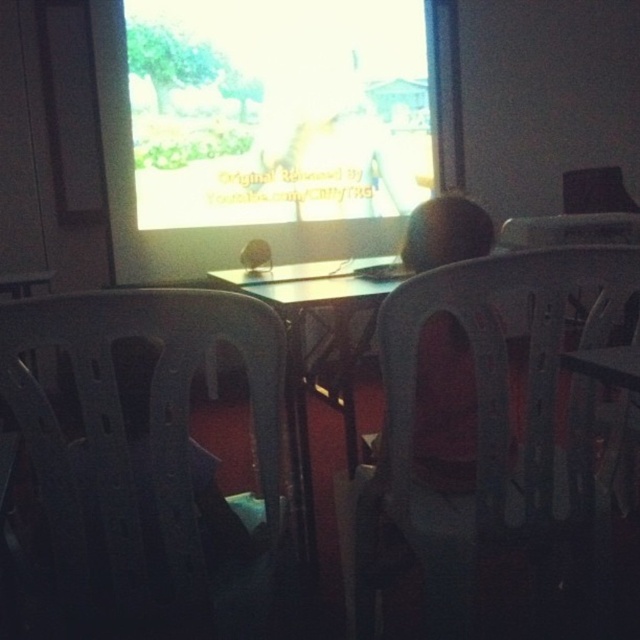
You are a parent trying to decide if your child can comfortably see the bright yellow screen at upper center while sitting in the transparent plastic chair at center. Based on their height difference, will the screen be visible to the child?

The bright yellow screen at upper center is much taller than the transparent plastic chair at center, so the screen may be positioned too high for the child to see comfortably without straining their neck.

You are planning to place a new poster on the wall behind the bright yellow screen at upper center and the transparent plastic chair at center. Based on their sizes, which object would require a larger poster to cover its entire width?

The bright yellow screen at upper center has a greater width than the transparent plastic chair at center, so it would require a larger poster to cover its entire width.

You are a guest entering the room and want to sit in the black plastic chair at left. However, you notice the bright yellow screen at upper center is blocking your path. Can you move around the screen to reach the chair?

The black plastic chair at left is behind the bright yellow screen at upper center, so you cannot directly access the chair without moving around the screen. Since the screen is at the upper center, you might need to go around either side of the screen to reach the chair.